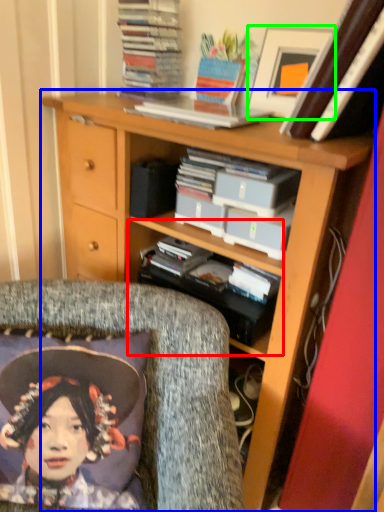
Question: Which is nearer to the shelf (highlighted by a red box)? bookcase (highlighted by a blue box) or picture frame (highlighted by a green box).

Choices:
 (A) bookcase
 (B) picture frame

Answer: (A)